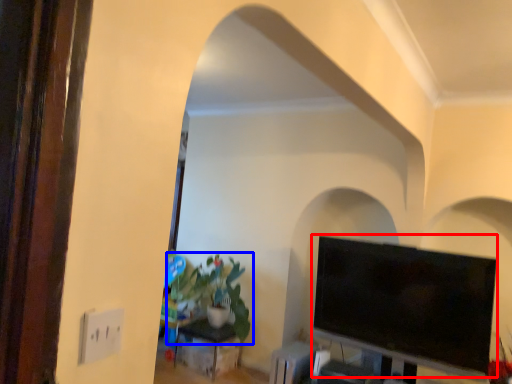
Question: Which of the following is the closest to the observer, television (highlighted by a red box) or houseplant (highlighted by a blue box)?

Choices:
 (A) television
 (B) houseplant

Answer: (A)